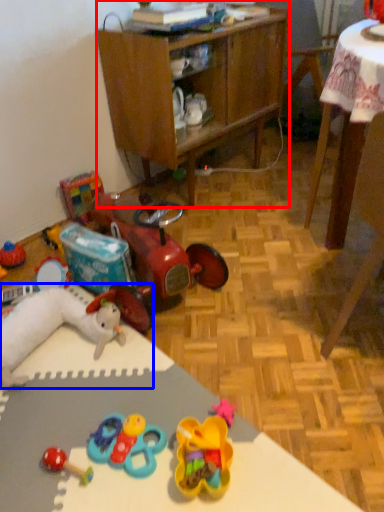
Question: Which of the following is the closest to the observer, cabinetry (highlighted by a red box) or toy (highlighted by a blue box)?

Choices:
 (A) cabinetry
 (B) toy

Answer: (B)